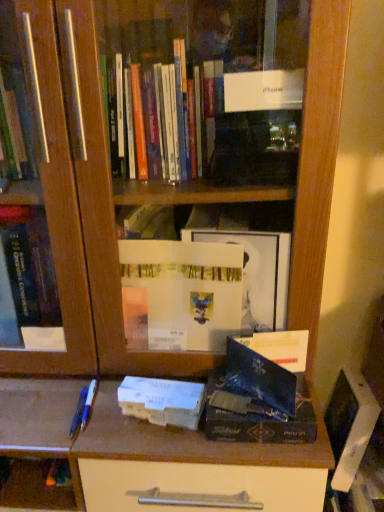
Question: In terms of size, does shiny black book at center, which appears as the 1th paperback book when viewed from the right, appear bigger or smaller than white matte paperback book at center, which ranks as the 1th paperback book in left-to-right order?

Choices:
 (A) big
 (B) small

Answer: (A)

Question: From the image's perspective, is shiny black book at center, which appears as the 1th paperback book when viewed from the right, positioned above or below white matte paperback book at center, which ranks as the 1th paperback book in left-to-right order?

Choices:
 (A) below
 (B) above

Answer: (A)

Question: Based on their relative distances, which object is nearer to the white matte paperback book at center, which is counted as the 2th paperback book, starting from the right?

Choices:
 (A) shiny black book at center, arranged as the 2th paperback book when viewed from the left
 (B) blue plastic pen at lower left, which is the first pen in right-to-left order
 (C) blue plastic pen at lower left, arranged as the 1th pen when viewed from the left

Answer: (A)

Question: Based on their relative distances, which object is nearer to the white matte paperback book at center, which is counted as the 2th paperback book, starting from the right?

Choices:
 (A) shiny black book at center, arranged as the 2th paperback book when viewed from the left
 (B) blue plastic pen at lower left, arranged as the 1th pen when viewed from the left
 (C) blue plastic pen at lower left, which ranks as the second pen in left-to-right order

Answer: (A)